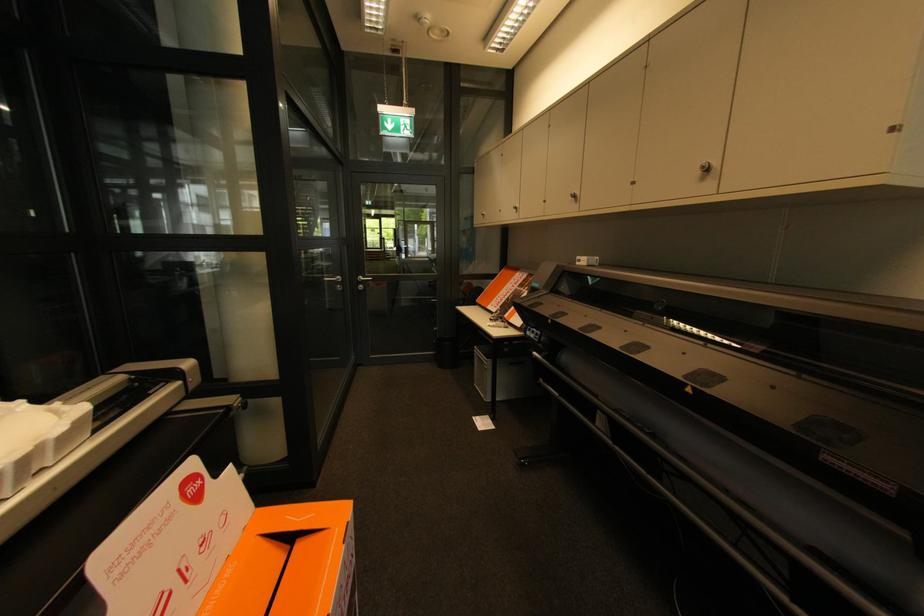
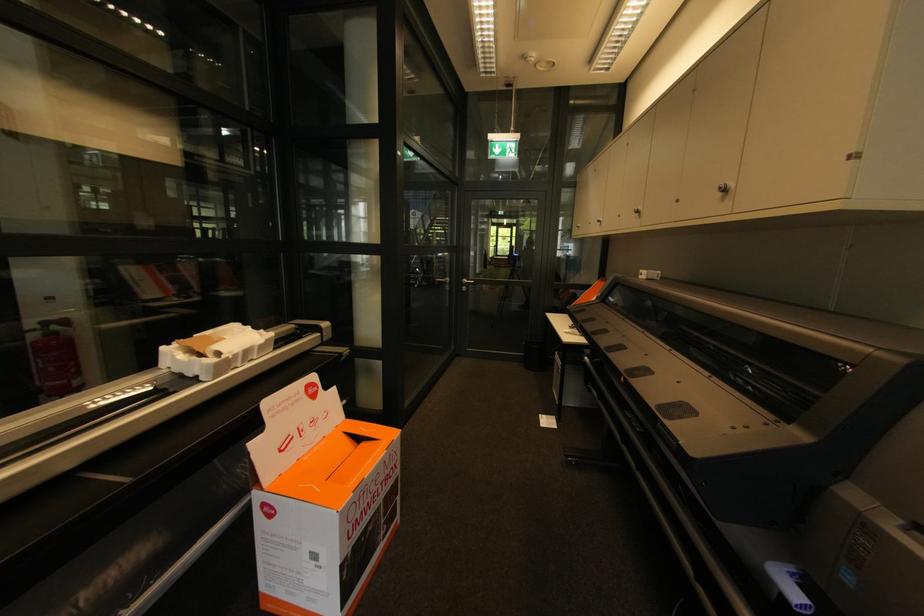
In the second image, find the point that corresponds to pixel 895 130 in the first image.

(857, 156)